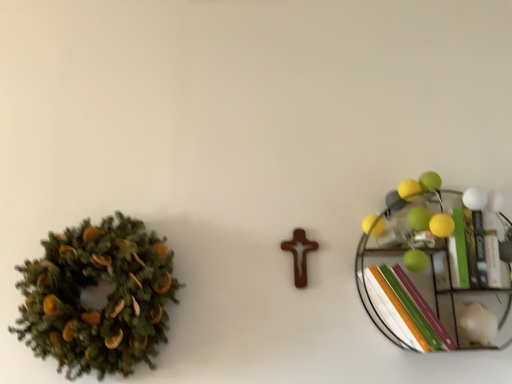
Question: Would you say green matte wreath at left is inside or outside green matte book at right?

Choices:
 (A) inside
 (B) outside

Answer: (B)

Question: In terms of width, does green matte wreath at left look wider or thinner when compared to green matte book at right?

Choices:
 (A) wide
 (B) thin

Answer: (B)

Question: Considering the real-world distances, which object is farthest from the green matte wreath at left?

Choices:
 (A) green matte book at right
 (B) metallic wire shelf at right

Answer: (A)

Question: Which object is positioned closest to the green matte wreath at left?

Choices:
 (A) metallic wire shelf at right
 (B) green matte book at right

Answer: (A)